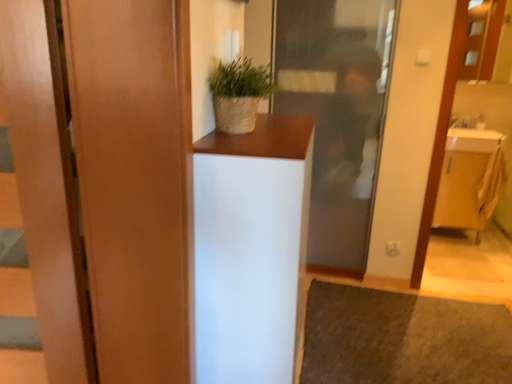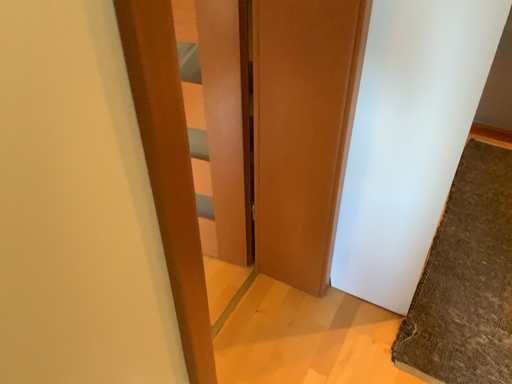
Question: How did the camera likely rotate when shooting the video?

Choices:
 (A) rotated left
 (B) rotated right

Answer: (A)